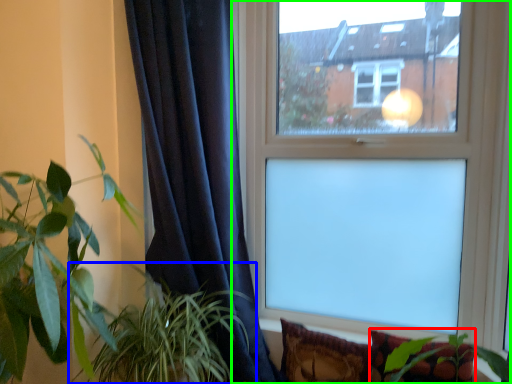
Question: Which is farther away from pillow (highlighted by a red box)? houseplant (highlighted by a blue box) or window (highlighted by a green box)?

Choices:
 (A) houseplant
 (B) window

Answer: (A)